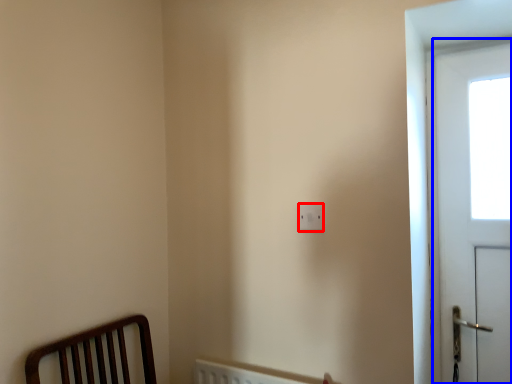
Question: Which object is further to the camera taking this photo, light switch (highlighted by a red box) or screen door (highlighted by a blue box)?

Choices:
 (A) light switch
 (B) screen door

Answer: (B)